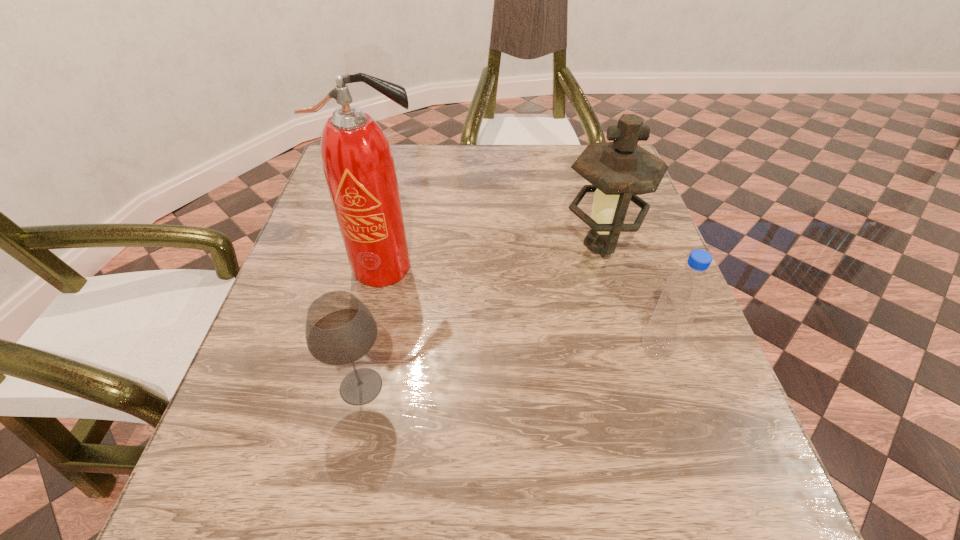
Find the location of a particular element. the tallest object is located at coordinates (358, 164).

The width and height of the screenshot is (960, 540). I want to click on oil lamp, so click(x=619, y=171).

Locate an element on the screen. water bottle is located at coordinates (685, 290).

This screenshot has height=540, width=960. I want to click on wineglass, so click(x=340, y=329).

Find the location of `free space located 0.260m on the back of the tallest object`. free space located 0.260m on the back of the tallest object is located at coordinates (403, 183).

Find the location of a particular element. The image size is (960, 540). vacant space located 0.290m on the front of the oil lamp is located at coordinates (641, 391).

Locate an element on the screen. The image size is (960, 540). free space located 0.200m on the front of the water bottle is located at coordinates (701, 481).

Locate an element on the screen. free space located 0.080m on the back of the wineglass is located at coordinates (373, 326).

What are the coordinates of `fire extinguisher situated at the left edge` in the screenshot? It's located at (358, 164).

Locate an element on the screen. Image resolution: width=960 pixels, height=540 pixels. wineglass located in the left edge section of the desktop is located at coordinates (340, 329).